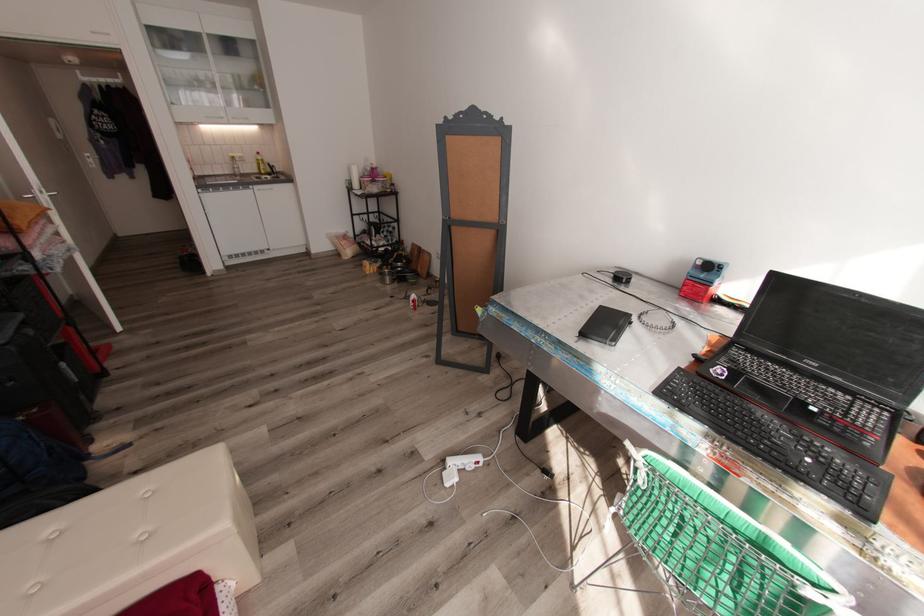
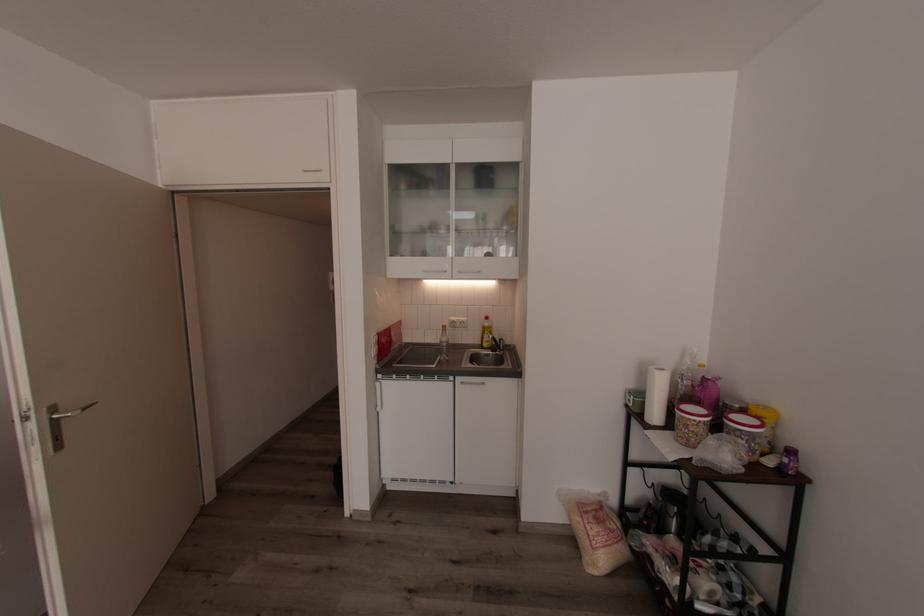
Find the pixel in the second image that matches (x=277, y=166) in the first image.

(505, 339)